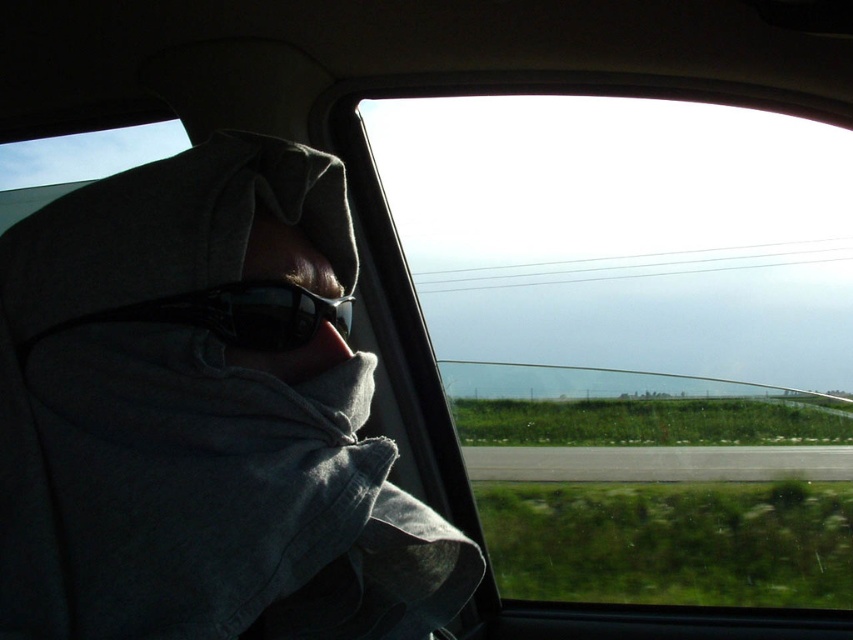
You are a passenger in a car and want to know if you can safely reach a point that is 19.84 inches away from your current position. The point is located at coordinates point [229,368]. Can you comfortably reach it without stretching too much?

The point [229,368] is 19.84 inches from the camera, so yes, you can comfortably reach it without stretching too much as it is within a typical comfortable reaching distance.

You are a passenger in a car and want to remove your black plastic goggles at left. To do so, you need to first move the gray fabric at left. Why?

The gray fabric at left is in front of the black plastic goggles at left, so you need to move it out of the way first to access the goggles.